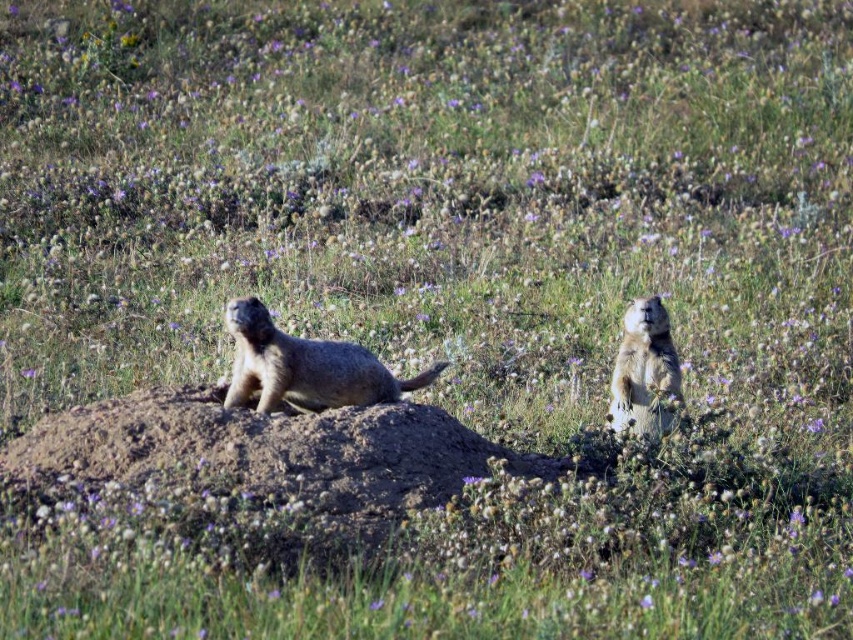
You are a photographer aiming to capture the brown dirt mound at center in your shot. The camera has a fixed focal length and you can only adjust your position. Where should you position yourself relative to the mound to ensure it is centered in the frame?

To center the brown dirt mound at center in the frame, position yourself directly in line with its 2D coordinates at point (256, 468).

You are a photographer trying to capture both the fuzzy brown ground squirrel at center and the furry beige groundhog at right in a single photo. Based on their positions, which animal will appear closer to the camera in the photo?

The fuzzy brown ground squirrel at center will appear closer to the camera because it is positioned in front of the furry beige groundhog at right.

You are a photographer trying to capture both the brown dirt mound at center and the furry beige groundhog at right in the same frame. Based on their positions, which one should you adjust your camera angle to focus on first to ensure both are in view?

The brown dirt mound at center is to the left of the furry beige groundhog at right, so you should focus on the furry beige groundhog at right first to ensure both are in view.